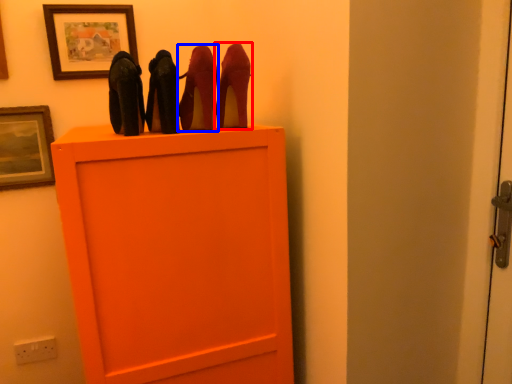
Question: Among these objects, which one is nearest to the camera, high heels (highlighted by a red box) or high heels (highlighted by a blue box)?

Choices:
 (A) high heels
 (B) high heels

Answer: (B)